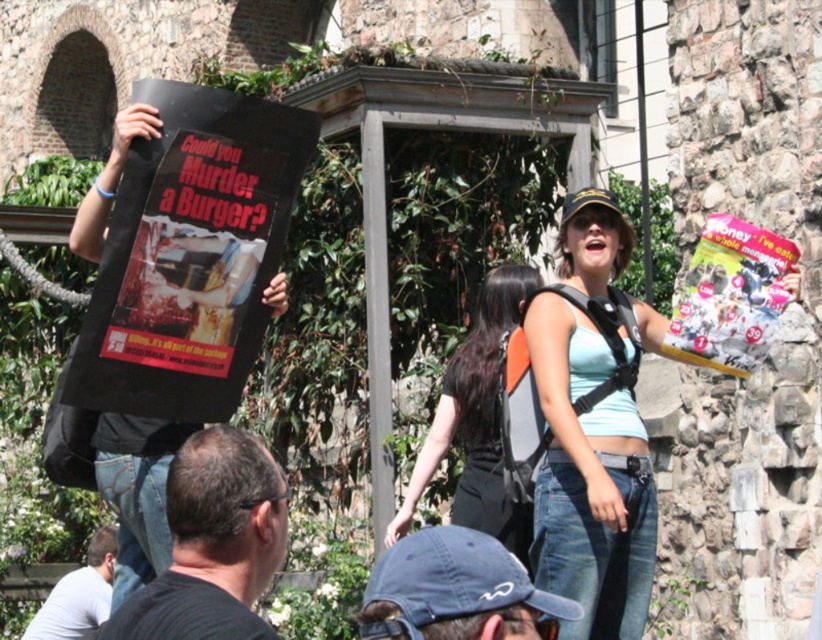
How distant is light blue denim jeans at center from black matte shirt at lower center?

28.99 feet

Who is more forward, (575, 490) or (234, 572)?

Positioned in front is point (234, 572).

Between point (560, 524) and point (224, 502), which one is positioned behind?

Point (560, 524)

The width and height of the screenshot is (822, 640). I want to click on light blue denim jeans at center, so click(x=593, y=428).

Does black t-shirt at left have a larger size compared to denim cap at lower center?

Yes, black t-shirt at left is bigger than denim cap at lower center.

Between black t-shirt at left and denim cap at lower center, which one is positioned higher?

black t-shirt at left

What are the coordinates of `black t-shirt at left` in the screenshot? It's located at (136, 492).

Who is positioned more to the right, light blue denim jeans at center or black fabric backpack at center?

light blue denim jeans at center is more to the right.

Is light blue denim jeans at center to the left of black fabric backpack at center from the viewer's perspective?

Incorrect, light blue denim jeans at center is not on the left side of black fabric backpack at center.

Locate an element on the screen. The image size is (822, 640). light blue denim jeans at center is located at coordinates (593, 428).

Locate an element on the screen. This screenshot has width=822, height=640. light blue denim jeans at center is located at coordinates (593, 428).